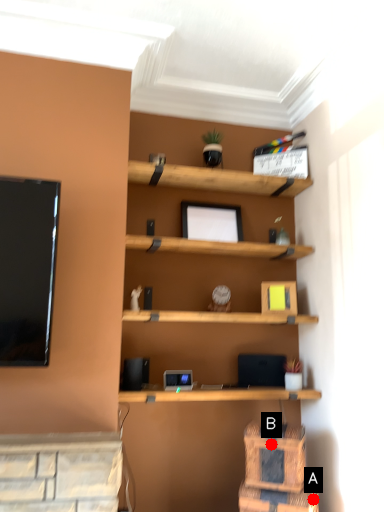
Question: Two points are circled on the image, labeled by A and B beside each circle. Which point is closer to the camera taking this photo?

Choices:
 (A) A is closer
 (B) B is closer

Answer: (B)